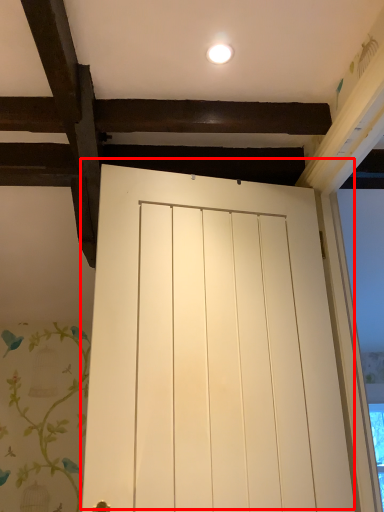
Question: From the image's perspective, where is door (annotated by the red box) located relative to lighting?

Choices:
 (A) above
 (B) below

Answer: (B)